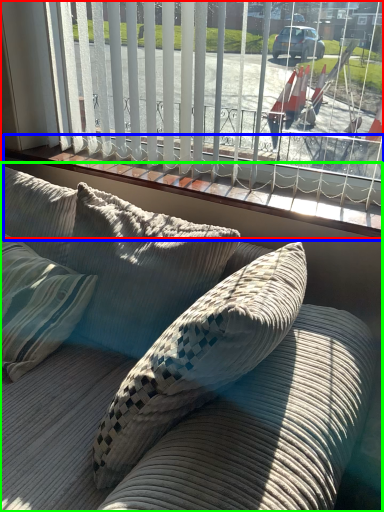
Question: Which object is positioned farthest from window (highlighted by a red box)? Select from window sill (highlighted by a blue box) and studio couch (highlighted by a green box).

Choices:
 (A) window sill
 (B) studio couch

Answer: (B)